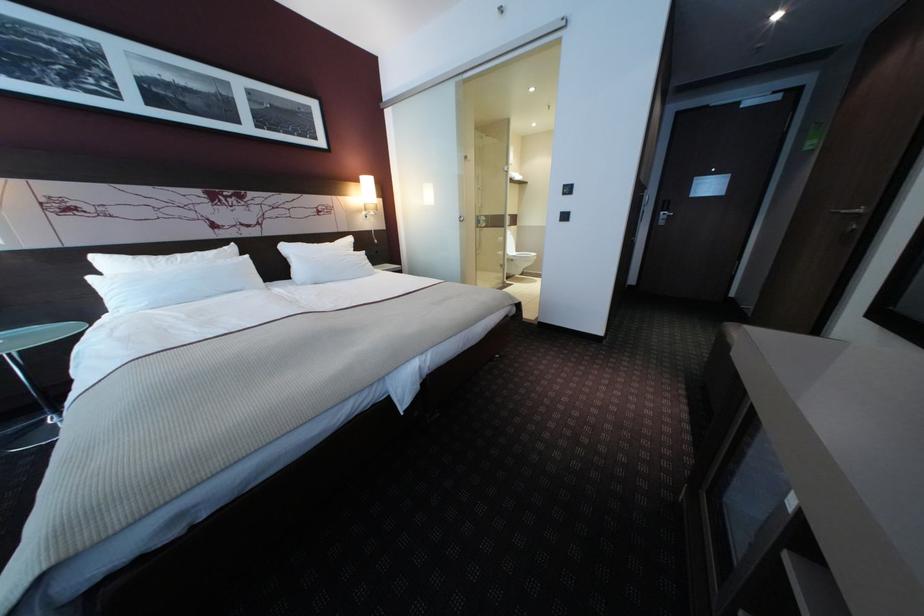
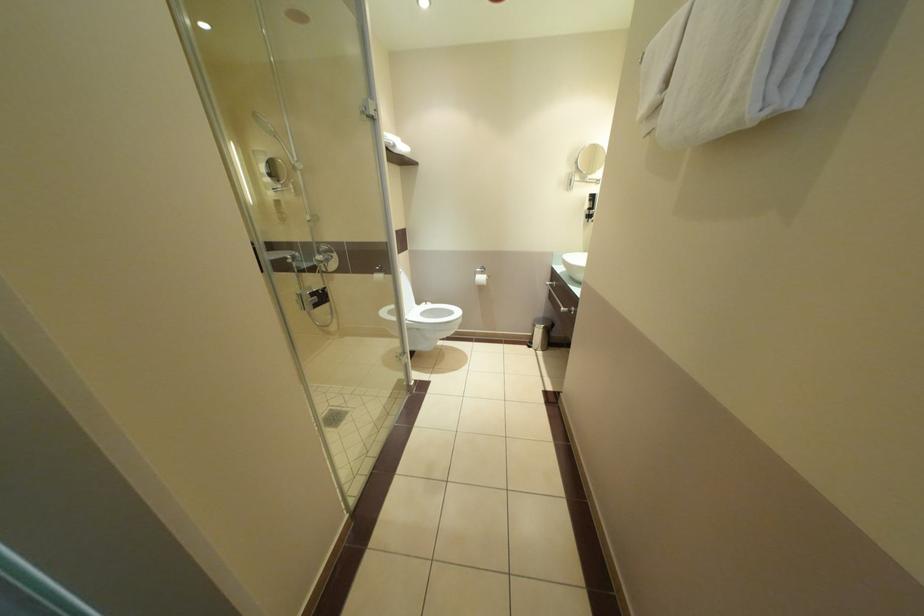
Question: In a continuous first-person perspective shot, in which direction is the camera moving?

Choices:
 (A) Left
 (B) Right
 (C) Forward
 (D) Backward

Answer: (C)